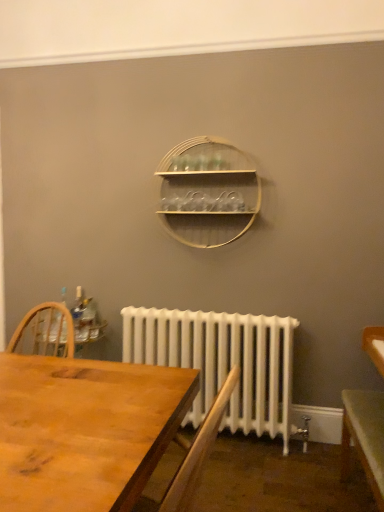
Question: Is wooden at center in front of white painted radiator at lower center?

Choices:
 (A) no
 (B) yes

Answer: (A)

Question: Is wooden at center to the right of white painted radiator at lower center from the viewer's perspective?

Choices:
 (A) no
 (B) yes

Answer: (A)

Question: Is wooden at center directly adjacent to white painted radiator at lower center?

Choices:
 (A) no
 (B) yes

Answer: (A)

Question: Does wooden at center have a lesser width compared to white painted radiator at lower center?

Choices:
 (A) no
 (B) yes

Answer: (B)

Question: Does wooden at center have a smaller size compared to white painted radiator at lower center?

Choices:
 (A) no
 (B) yes

Answer: (B)

Question: Is wooden desk at center inside the boundaries of clear plastic bottle at left, or outside?

Choices:
 (A) outside
 (B) inside

Answer: (A)

Question: Is wooden desk at center in front of or behind clear plastic bottle at left in the image?

Choices:
 (A) front
 (B) behind

Answer: (A)

Question: Is wooden desk at center taller or shorter than clear plastic bottle at left?

Choices:
 (A) short
 (B) tall

Answer: (B)

Question: From the image's perspective, is wooden desk at center above or below clear plastic bottle at left?

Choices:
 (A) below
 (B) above

Answer: (A)

Question: In terms of height, does wooden at center look taller or shorter compared to clear plastic bottle at left?

Choices:
 (A) short
 (B) tall

Answer: (B)

Question: Is wooden at center bigger or smaller than clear plastic bottle at left?

Choices:
 (A) big
 (B) small

Answer: (A)

Question: Would you say wooden at center is inside or outside clear plastic bottle at left?

Choices:
 (A) inside
 (B) outside

Answer: (B)

Question: Is wooden at center in front of or behind clear plastic bottle at left in the image?

Choices:
 (A) behind
 (B) front

Answer: (B)

Question: From the image's perspective, relative to white painted radiator at lower center, is wooden at center above or below?

Choices:
 (A) above
 (B) below

Answer: (A)

Question: In terms of width, does wooden at center look wider or thinner when compared to white painted radiator at lower center?

Choices:
 (A) thin
 (B) wide

Answer: (A)